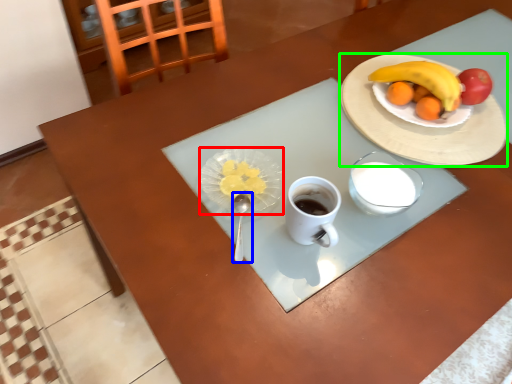
Question: Which object is the closest to the tableware (highlighted by a red box)? Choose among these: utensil (highlighted by a blue box) or plate (highlighted by a green box).

Choices:
 (A) utensil
 (B) plate

Answer: (A)